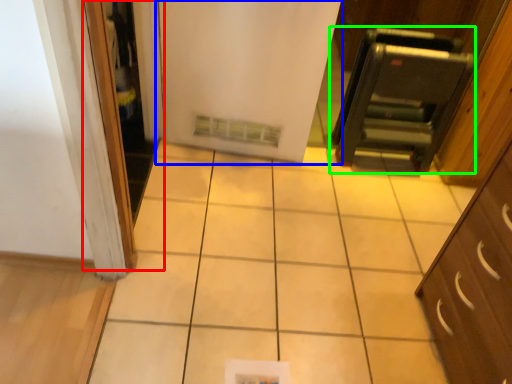
Question: Estimate the real-world distances between objects in this image. Which object is farther from screen door (highlighted by a red box), door (highlighted by a blue box) or appliance (highlighted by a green box)?

Choices:
 (A) door
 (B) appliance

Answer: (B)